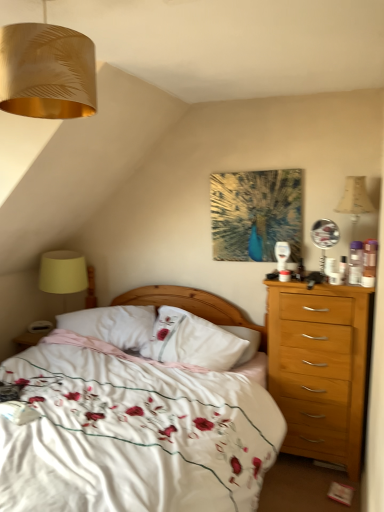
Question: From a real-world perspective, is white soft pillow at center, which is the 1th pillow from left to right, positioned over yellow fabric lampshade at left based on gravity?

Choices:
 (A) yes
 (B) no

Answer: (B)

Question: Is yellow fabric lampshade at left inside white soft pillow at center, which is the 1th pillow from left to right?

Choices:
 (A) yes
 (B) no

Answer: (B)

Question: Is white soft pillow at center, which is the 1th pillow from left to right, positioned behind yellow fabric lampshade at left?

Choices:
 (A) yes
 (B) no

Answer: (B)

Question: Is white soft pillow at center, which is the 1th pillow from left to right, smaller than yellow fabric lampshade at left?

Choices:
 (A) no
 (B) yes

Answer: (B)

Question: Is white soft pillow at center, the 2th pillow when ordered from right to left, looking in the opposite direction of yellow fabric lampshade at left?

Choices:
 (A) yes
 (B) no

Answer: (B)

Question: From the image's perspective, is yellow fabric lampshade at left located above or below white soft pillow at center, the 2th pillow when ordered from right to left?

Choices:
 (A) above
 (B) below

Answer: (A)

Question: Would you say yellow fabric lampshade at left is to the left or to the right of white soft pillow at center, which is the 1th pillow from left to right, in the picture?

Choices:
 (A) right
 (B) left

Answer: (B)

Question: Is yellow fabric lampshade at left inside the boundaries of white soft pillow at center, which is the 1th pillow from left to right, or outside?

Choices:
 (A) inside
 (B) outside

Answer: (B)

Question: Looking at their shapes, would you say yellow fabric lampshade at left is wider or thinner than white soft pillow at center, the 2th pillow when ordered from right to left?

Choices:
 (A) thin
 (B) wide

Answer: (A)

Question: Is white soft pillow at center, the first pillow from the right, spatially inside yellow fabric lampshade at left, or outside of it?

Choices:
 (A) inside
 (B) outside

Answer: (B)

Question: Is white soft pillow at center, arranged as the second pillow when viewed from the left, wider or thinner than yellow fabric lampshade at left?

Choices:
 (A) wide
 (B) thin

Answer: (B)

Question: Is point tap(177, 321) closer or farther from the camera than point tap(44, 290)?

Choices:
 (A) closer
 (B) farther

Answer: (A)

Question: Considering the relative positions of white soft pillow at center, arranged as the second pillow when viewed from the left, and yellow fabric lampshade at left in the image provided, is white soft pillow at center, arranged as the second pillow when viewed from the left, to the left or to the right of yellow fabric lampshade at left?

Choices:
 (A) left
 (B) right

Answer: (B)

Question: In terms of width, does white floral duvet at center look wider or thinner when compared to gold metallic lampshade at upper left?

Choices:
 (A) thin
 (B) wide

Answer: (B)

Question: In the image, is white floral duvet at center positioned in front of or behind gold metallic lampshade at upper left?

Choices:
 (A) front
 (B) behind

Answer: (A)